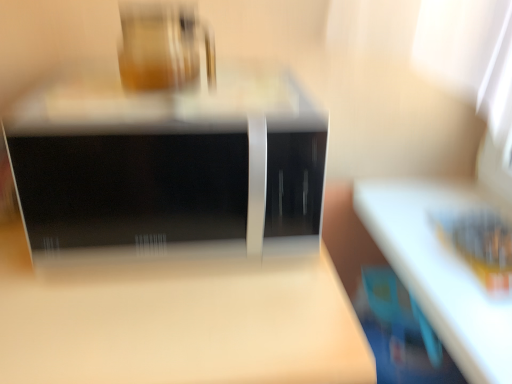
Describe the element at coordinates (163, 47) in the screenshot. I see `matte glass jar at upper center` at that location.

Where is `matte glass jar at upper center`? Image resolution: width=512 pixels, height=384 pixels. matte glass jar at upper center is located at coordinates (163, 47).

I want to click on matte wood table at center, so click(178, 324).

Locate an element on the screen. black glossy microwave at center is located at coordinates (168, 169).

Is matte wood table at center oriented away from matte glass jar at upper center?

No.

Is matte wood table at center at the left side of matte glass jar at upper center?

Yes, matte wood table at center is to the left of matte glass jar at upper center.

Is point (148, 328) positioned before point (156, 27)?

Yes, it is.

Is matte glass jar at upper center surrounded by matte wood table at center?

No, matte glass jar at upper center is not a part of matte wood table at center.

Can we say matte glass jar at upper center lies outside black glossy microwave at center?

Indeed, matte glass jar at upper center is completely outside black glossy microwave at center.

From the picture: Is matte glass jar at upper center oriented away from black glossy microwave at center?

No, matte glass jar at upper center's orientation is not away from black glossy microwave at center.

How many degrees apart are the facing directions of matte glass jar at upper center and black glossy microwave at center?

The angular difference between matte glass jar at upper center and black glossy microwave at center is 0.000465 degrees.

Considering the points (189, 26) and (88, 141), which point is in front, point (189, 26) or point (88, 141)?

The point (88, 141) is closer to the camera.

Which object is positioned more to the right, matte glass jar at upper center or matte wood table at center?

matte glass jar at upper center is more to the right.

Looking at this image, is matte glass jar at upper center completely or partially outside of matte wood table at center?

Indeed, matte glass jar at upper center is completely outside matte wood table at center.

From a real-world perspective, between matte glass jar at upper center and matte wood table at center, who is vertically lower?

From a 3D spatial view, matte wood table at center is below.

The image size is (512, 384). I want to click on home appliance positioned vertically above the matte wood table at center (from a real-world perspective), so click(168, 169).

Is black glossy microwave at center facing towards matte wood table at center?

No, black glossy microwave at center is not facing towards matte wood table at center.

Which object is positioned more to the right, black glossy microwave at center or matte wood table at center?

From the viewer's perspective, black glossy microwave at center appears more on the right side.

Is black glossy microwave at center inside or outside of matte glass jar at upper center?

black glossy microwave at center cannot be found inside matte glass jar at upper center.

Could you tell me if black glossy microwave at center is turned towards matte glass jar at upper center?

No, black glossy microwave at center does not turn towards matte glass jar at upper center.

Who is taller, black glossy microwave at center or matte glass jar at upper center?

black glossy microwave at center.

Considering the sizes of black glossy microwave at center and matte glass jar at upper center in the image, is black glossy microwave at center wider or thinner than matte glass jar at upper center?

In the image, black glossy microwave at center appears to be wider than matte glass jar at upper center.

Based on the photo, considering the sizes of matte wood table at center and black glossy microwave at center in the image, is matte wood table at center wider or thinner than black glossy microwave at center?

Considering their sizes, matte wood table at center looks broader than black glossy microwave at center.

From a real-world perspective, which object rests below the other?

From a 3D spatial view, matte wood table at center is below.

From the image's perspective, who appears lower, matte wood table at center or black glossy microwave at center?

matte wood table at center appears lower in the image.

Would you say matte wood table at center is inside or outside black glossy microwave at center?

matte wood table at center lies outside black glossy microwave at center.

This screenshot has width=512, height=384. In order to click on table below the matte glass jar at upper center (from the image's perspective) in this screenshot , I will do `click(178, 324)`.

You are a GUI agent. You are given a task and a screenshot of the screen. Output one action in this format:
    pyautogui.click(x=<x>, y=<y>)
    Task: Click on the appliance lying on the left of black glossy microwave at center
    The image size is (512, 384).
    Given the screenshot: What is the action you would take?
    pyautogui.click(x=163, y=47)

When comparing their distances from black glossy microwave at center, does matte glass jar at upper center or matte wood table at center seem closer?

matte glass jar at upper center is positioned closer to the anchor black glossy microwave at center.

Estimate the real-world distances between objects in this image. Which object is further from matte wood table at center, matte glass jar at upper center or black glossy microwave at center?

matte glass jar at upper center.

Estimate the real-world distances between objects in this image. Which object is closer to black glossy microwave at center, matte wood table at center or matte glass jar at upper center?

The object closer to black glossy microwave at center is matte glass jar at upper center.

Which object lies nearer to the anchor point matte glass jar at upper center, matte wood table at center or black glossy microwave at center?

Among the two, black glossy microwave at center is located nearer to matte glass jar at upper center.

Which object lies further to the anchor point matte wood table at center, black glossy microwave at center or matte glass jar at upper center?

Based on the image, matte glass jar at upper center appears to be further to matte wood table at center.

Based on their spatial positions, is black glossy microwave at center or matte wood table at center further from matte glass jar at upper center?

matte wood table at center is further to matte glass jar at upper center.

You are a GUI agent. You are given a task and a screenshot of the screen. Output one action in this format:
    pyautogui.click(x=<x>, y=<y>)
    Task: Click on the home appliance between matte glass jar at upper center and matte wood table at center in the up-down direction
    
    Given the screenshot: What is the action you would take?
    pyautogui.click(x=168, y=169)